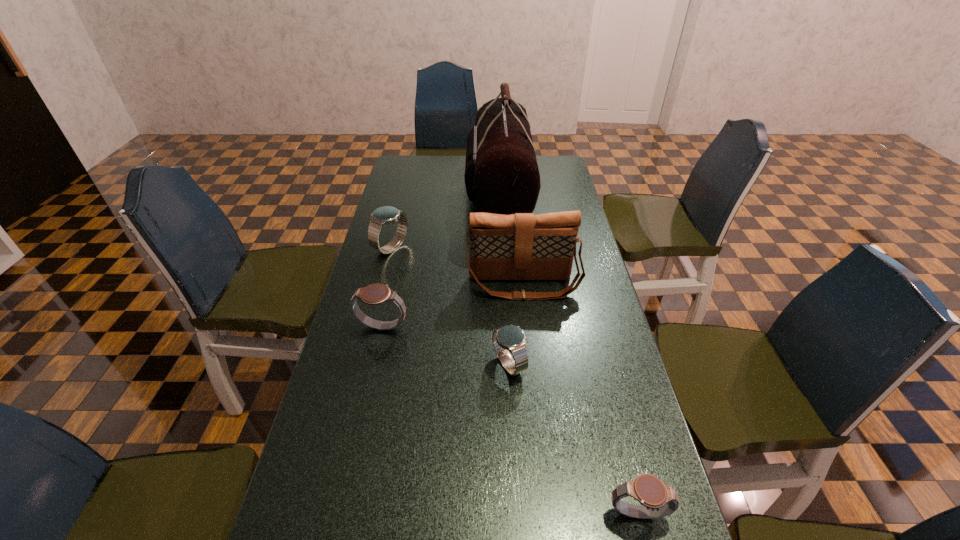
What are the coordinates of `the farthest object` in the screenshot? It's located at (501, 175).

This screenshot has width=960, height=540. Identify the location of red duffel bag. (501, 175).

Find the location of a particular element. The width and height of the screenshot is (960, 540). shoulder bag is located at coordinates point(522,246).

Where is `the fifth nearest object`? This screenshot has width=960, height=540. the fifth nearest object is located at coordinates (522, 246).

Where is `the farthest blue watch`? This screenshot has height=540, width=960. the farthest blue watch is located at coordinates (386, 215).

Where is `the leftmost blue watch`? the leftmost blue watch is located at coordinates (386, 215).

Where is `the left gray watch`? The image size is (960, 540). the left gray watch is located at coordinates (375, 294).

At what (x,y) coordinates should I click in order to perform the action: click on the farther gray watch. Please return your answer as a coordinate pair (x, y). Looking at the image, I should click on (375, 294).

I want to click on the rightmost blue watch, so tap(511, 338).

Image resolution: width=960 pixels, height=540 pixels. I want to click on the second watch from right to left, so click(511, 338).